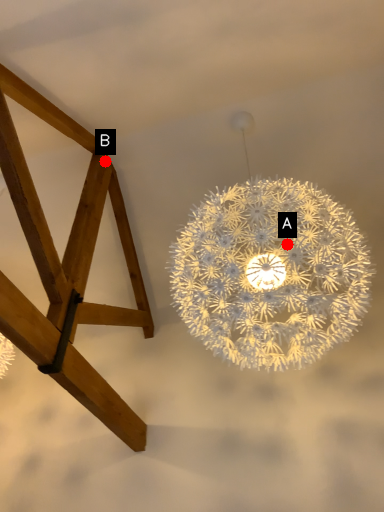
Question: Two points are circled on the image, labeled by A and B beside each circle. Which point is closer to the camera taking this photo?

Choices:
 (A) A is closer
 (B) B is closer

Answer: (A)